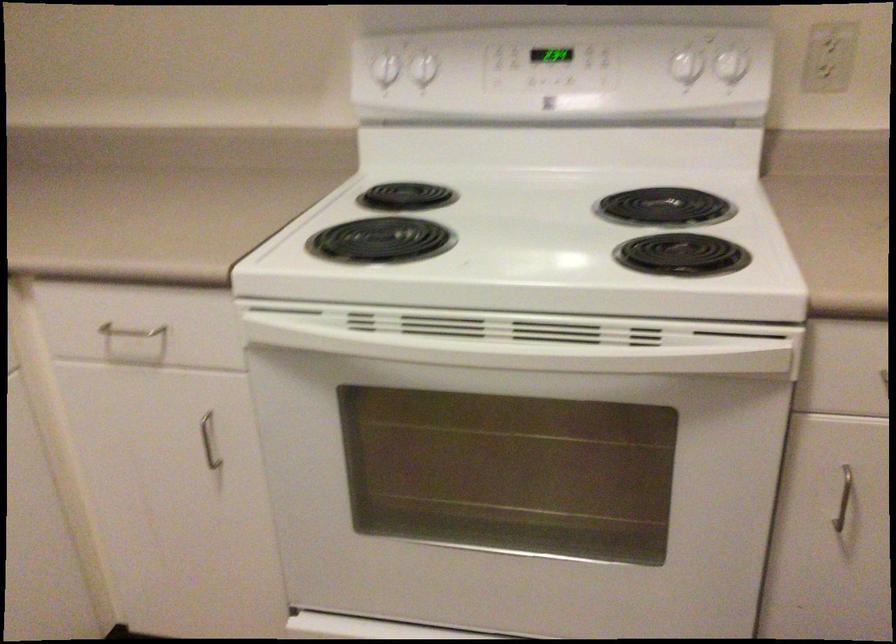
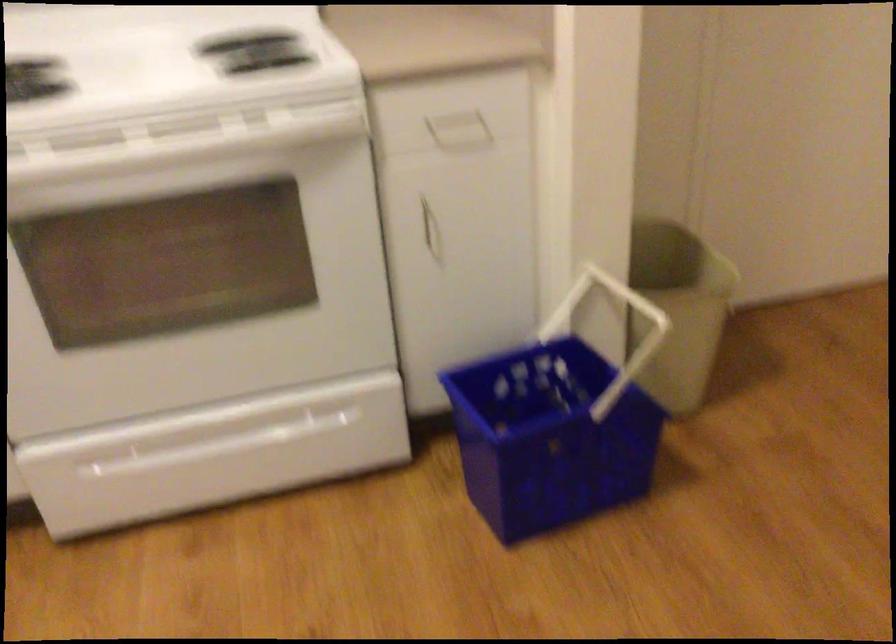
Question: The camera is either moving clockwise (left) or counter-clockwise (right) around the object. The first image is from the beginning of the video and the second image is from the end. Is the camera moving left or right when shooting the video?

Choices:
 (A) Left
 (B) Right

Answer: (A)